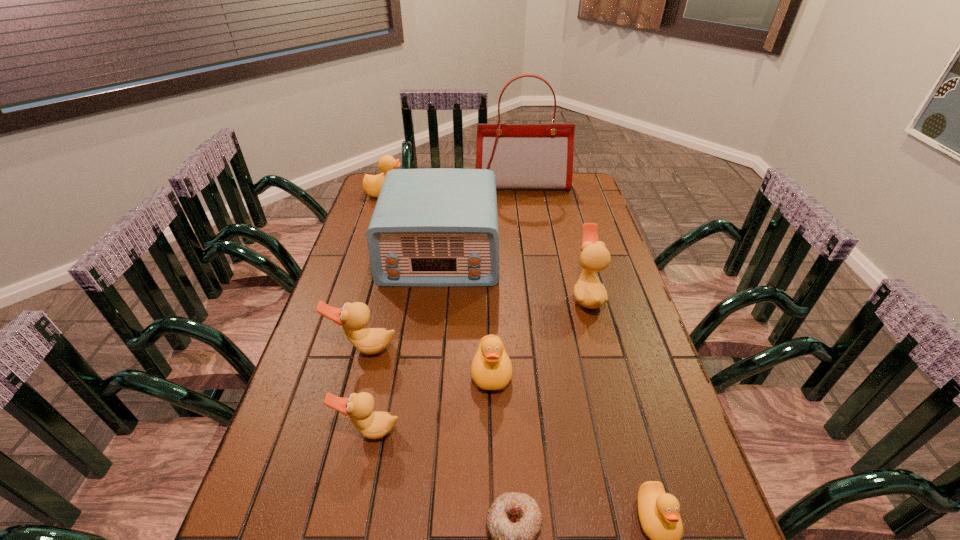
Locate an element on the screen. the third nearest object is located at coordinates (373, 425).

Identify the location of the nearest tan duck. The image size is (960, 540). (373, 425).

Locate an element on the screen. free spot located on the front of the tallest object is located at coordinates (526, 214).

At what (x,y) coordinates should I click in order to perform the action: click on vacant space positioned 0.090m on the front panel of the radio receiver. Please return your answer as a coordinate pair (x, y). Image resolution: width=960 pixels, height=540 pixels. Looking at the image, I should click on (435, 308).

Find the location of a particular element. The width and height of the screenshot is (960, 540). free space located on the beak of the tallest duck is located at coordinates (555, 295).

Find the location of a particular element. free location located on the beak of the tallest duck is located at coordinates (502, 295).

Where is `vacant space situated on the beak of the tallest duck`? The height and width of the screenshot is (540, 960). vacant space situated on the beak of the tallest duck is located at coordinates (456, 295).

At what (x,y) coordinates should I click in order to perform the action: click on vacant space located 0.210m on the face of the biggest yellow duck. Please return your answer as a coordinate pair (x, y). Looking at the image, I should click on click(x=462, y=193).

The height and width of the screenshot is (540, 960). I want to click on free point located on the beak of the second biggest tan duck, so click(x=320, y=524).

You are a GUI agent. You are given a task and a screenshot of the screen. Output one action in this format:
    pyautogui.click(x=<x>, y=<y>)
    Task: Click on the vacant space located 0.210m on the face of the third duck from right to left
    This screenshot has height=540, width=960.
    Given the screenshot: What is the action you would take?
    pyautogui.click(x=494, y=482)